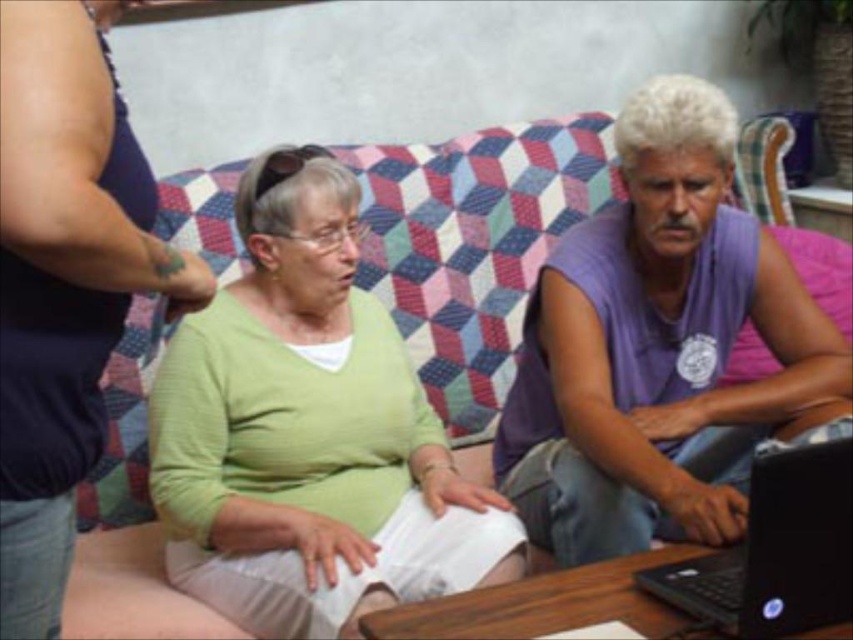
Who is more distant from viewer, (6, 308) or (782, 472)?

The point (782, 472) is more distant.

Can you confirm if matte green sweater at center is bigger than black plastic laptop at lower right?

Yes.

Find the location of `matte green sweater at center`. matte green sweater at center is located at coordinates (62, 282).

Is green matte sweater at center shorter than matte green sweater at center?

Incorrect, green matte sweater at center's height does not fall short of matte green sweater at center's.

Which of these two, green matte sweater at center or matte green sweater at center, stands shorter?

matte green sweater at center is shorter.

Consider the image. Who is more forward, (x=289, y=444) or (x=68, y=108)?

Point (x=68, y=108) is more forward.

At what (x,y) coordinates should I click in order to perform the action: click on green matte sweater at center. Please return your answer as a coordinate pair (x, y). Looking at the image, I should click on (309, 433).

Can you confirm if purple sleeveless shirt at right is positioned to the right of matte green sweater at center?

Indeed, purple sleeveless shirt at right is positioned on the right side of matte green sweater at center.

Is point (553, 289) closer to camera compared to point (49, 580)?

No, it is not.

What are the coordinates of `purple sleeveless shirt at right` in the screenshot? It's located at (657, 348).